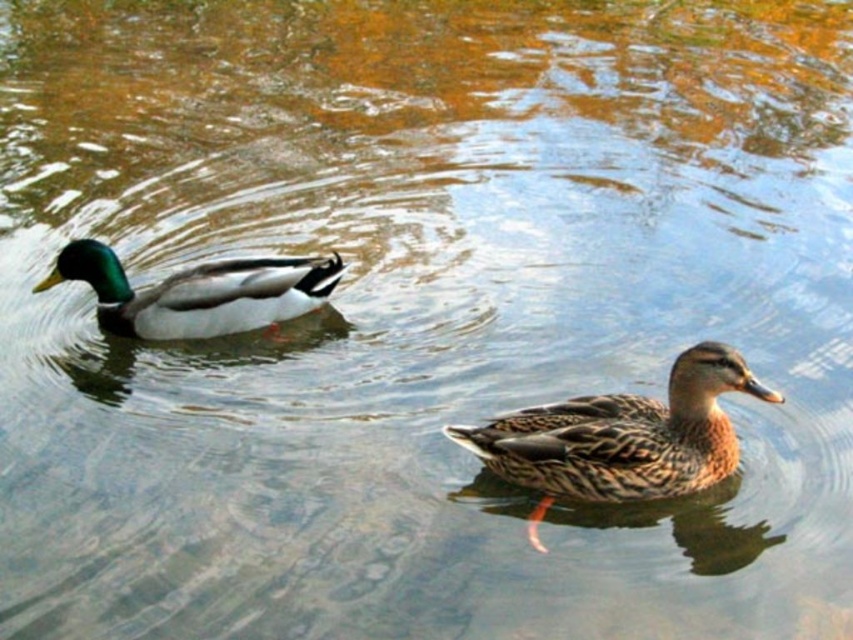
Question: From the image, what is the correct spatial relationship of brown speckled duck at center in relation to shiny green and white duck at left?

Choices:
 (A) above
 (B) below

Answer: (B)

Question: Can you confirm if brown speckled duck at center is thinner than shiny green and white duck at left?

Choices:
 (A) yes
 (B) no

Answer: (A)

Question: Among these objects, which one is farthest from the camera?

Choices:
 (A) brown speckled duck at center
 (B) shiny green and white duck at left

Answer: (B)

Question: Considering the relative positions of brown speckled duck at center and shiny green and white duck at left in the image provided, where is brown speckled duck at center located with respect to shiny green and white duck at left?

Choices:
 (A) above
 (B) below

Answer: (B)